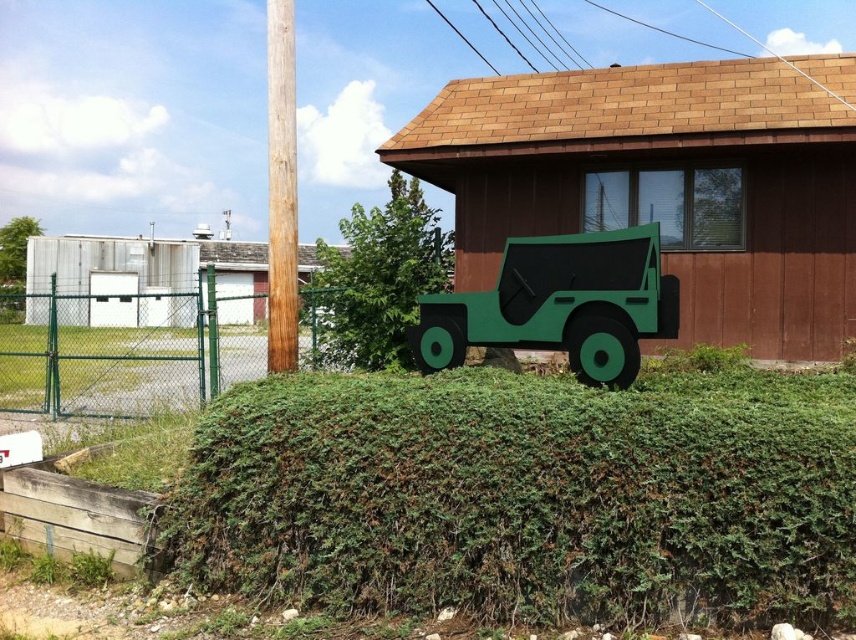
Does green leafy hedge at center have a larger size compared to green matte bush at upper left?

Incorrect, green leafy hedge at center is not larger than green matte bush at upper left.

Looking at this image, who is positioned more to the right, green leafy hedge at center or green matte bush at upper left?

Positioned to the right is green leafy hedge at center.

Image resolution: width=856 pixels, height=640 pixels. What are the coordinates of `green leafy hedge at center` in the screenshot? It's located at (526, 497).

Locate an element on the screen. green leafy hedge at center is located at coordinates (526, 497).

Can you confirm if green leafy hedge at center is taller than green chain-link fence at left?

No, green leafy hedge at center is not taller than green chain-link fence at left.

Who is more distant from viewer, [611,412] or [99,305]?

Point [99,305]

This screenshot has width=856, height=640. Identify the location of green leafy hedge at center. (526, 497).

Does brown wood pole at center appear over green matte bush at upper left?

Yes, brown wood pole at center is above green matte bush at upper left.

Find the location of a particular element. The width and height of the screenshot is (856, 640). brown wood pole at center is located at coordinates (281, 188).